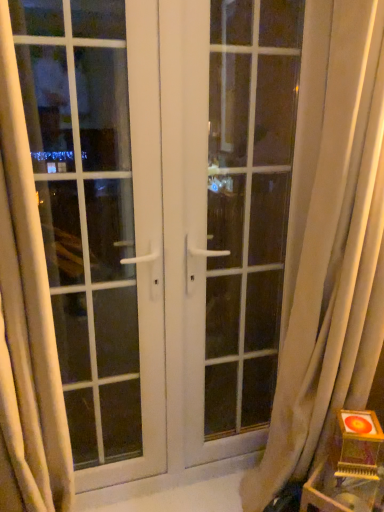
Locate an element on the screen. Image resolution: width=384 pixels, height=512 pixels. white glossy door at center is located at coordinates (239, 217).

Measure the distance between point (48,508) and camera.

They are 1.10 meters apart.

The height and width of the screenshot is (512, 384). In order to click on white sheer curtain at right, acting as the 2th curtain starting from the left in this screenshot , I will do `click(329, 243)`.

At what (x,y) coordinates should I click in order to perform the action: click on wooden table at lower right. Please return your answer as a coordinate pair (x, y). Looking at the image, I should click on (343, 490).

Which curtain is the 2nd one when counting from the left side of the wooden table at lower right? Please provide its 2D coordinates.

[(26, 324)]

Is white sheer curtain at left, the 1th curtain viewed from the left, far from wooden table at lower right?

No, white sheer curtain at left, the 1th curtain viewed from the left, is not far away from wooden table at lower right.

Considering the sizes of objects white sheer curtain at left, the 1th curtain viewed from the left, and wooden table at lower right in the image provided, who is smaller, white sheer curtain at left, the 1th curtain viewed from the left, or wooden table at lower right?

Smaller between the two is wooden table at lower right.

Is white sheer curtain at left, the 1th curtain viewed from the left, looking in the opposite direction of wooden table at lower right?

No, white sheer curtain at left, the 1th curtain viewed from the left, is not facing the opposite direction of wooden table at lower right.

Does point (31, 396) come closer to viewer compared to point (232, 40)?

Yes, it is.

Looking at this image, considering the relative sizes of white sheer curtain at left, placed as the second curtain when sorted from right to left, and white glossy door at center in the image provided, is white sheer curtain at left, placed as the second curtain when sorted from right to left, smaller than white glossy door at center?

Yes, white sheer curtain at left, placed as the second curtain when sorted from right to left, is smaller than white glossy door at center.

How many degrees apart are the facing directions of white sheer curtain at left, the 1th curtain viewed from the left, and white glossy door at center?

There is a 0.993-degree angle between the facing directions of white sheer curtain at left, the 1th curtain viewed from the left, and white glossy door at center.

Considering the positions of objects white sheer curtain at left, the 1th curtain viewed from the left, and white glossy door at center in the image provided, who is in front, white sheer curtain at left, the 1th curtain viewed from the left, or white glossy door at center?

white sheer curtain at left, the 1th curtain viewed from the left.

Which of these two, white glossy door at center or white sheer curtain at left, the 1th curtain viewed from the left, is bigger?

With larger size is white glossy door at center.

From their relative heights in the image, would you say white glossy door at center is taller or shorter than white sheer curtain at left, placed as the second curtain when sorted from right to left?

Clearly, white glossy door at center is taller compared to white sheer curtain at left, placed as the second curtain when sorted from right to left.

Does white glossy door at center touch white sheer curtain at left, the 1th curtain viewed from the left?

No, white glossy door at center is not in contact with white sheer curtain at left, the 1th curtain viewed from the left.

Considering the sizes of objects white glossy door at center and white sheer curtain at left, the 1th curtain viewed from the left, in the image provided, who is thinner, white glossy door at center or white sheer curtain at left, the 1th curtain viewed from the left,?

Thinner between the two is white glossy door at center.

In the scene shown: From a real-world perspective, is white glossy door at center above or below white glass window at center?

white glossy door at center is situated higher than white glass window at center in the real world.

From the image's perspective, is white glossy door at center above white glass window at center?

Correct, white glossy door at center appears higher than white glass window at center in the image.

Based on the photo, how different are the orientations of white glossy door at center and white glass window at center in degrees?

The angular difference between white glossy door at center and white glass window at center is 0.015 degrees.

Does white glossy door at center touch white glass window at center?

No, white glossy door at center is not in contact with white glass window at center.

Which object is further away from the camera, white glass window at center or white sheer curtain at right, the first curtain in the right-to-left sequence?

white glass window at center is further away from the camera.

From a real-world perspective, is white glass window at center located beneath white sheer curtain at right, acting as the 2th curtain starting from the left?

No.

How many degrees apart are the facing directions of white glass window at center and white sheer curtain at right, acting as the 2th curtain starting from the left?

The angle between the facing direction of white glass window at center and the facing direction of white sheer curtain at right, acting as the 2th curtain starting from the left, is 0.99 degrees.

From the image's perspective, relative to white sheer curtain at right, acting as the 2th curtain starting from the left, is white glass window at center above or below?

white glass window at center is above white sheer curtain at right, acting as the 2th curtain starting from the left.

Is wooden table at lower right inside or outside of white glossy door at center?

wooden table at lower right lies outside white glossy door at center.

Considering the sizes of wooden table at lower right and white glossy door at center in the image, is wooden table at lower right wider or thinner than white glossy door at center?

Clearly, wooden table at lower right has more width compared to white glossy door at center.

Does wooden table at lower right lie behind white glossy door at center?

No, it is in front of white glossy door at center.

Does point (369, 489) lie behind point (186, 384)?

No.

Does white sheer curtain at left, placed as the second curtain when sorted from right to left, turn towards white sheer curtain at right, the first curtain in the right-to-left sequence?

No, white sheer curtain at left, placed as the second curtain when sorted from right to left, is not oriented towards white sheer curtain at right, the first curtain in the right-to-left sequence.

Who is taller, white sheer curtain at left, the 1th curtain viewed from the left, or white sheer curtain at right, the first curtain in the right-to-left sequence?

white sheer curtain at right, the first curtain in the right-to-left sequence.

Which object is further away from the camera taking this photo, white sheer curtain at left, the 1th curtain viewed from the left, or white sheer curtain at right, the first curtain in the right-to-left sequence?

white sheer curtain at right, the first curtain in the right-to-left sequence, is more distant.

From the image's perspective, is white sheer curtain at left, placed as the second curtain when sorted from right to left, above or below white sheer curtain at right, acting as the 2th curtain starting from the left?

Clearly, from the image's perspective, white sheer curtain at left, placed as the second curtain when sorted from right to left, is below white sheer curtain at right, acting as the 2th curtain starting from the left.

At what (x,y) coordinates should I click in order to perform the action: click on curtain that is the 2nd one when counting forward from the wooden table at lower right. Please return your answer as a coordinate pair (x, y). This screenshot has width=384, height=512. Looking at the image, I should click on (26, 324).

Identify the location of the 2nd curtain below the white glossy door at center (from the image's perspective). [x=26, y=324].

Looking at the image, which one is located closer to white sheer curtain at left, the 1th curtain viewed from the left, white sheer curtain at right, acting as the 2th curtain starting from the left, or white glossy door at center?

white sheer curtain at right, acting as the 2th curtain starting from the left, is positioned closer to the anchor white sheer curtain at left, the 1th curtain viewed from the left.

Estimate the real-world distances between objects in this image. Which object is closer to white sheer curtain at right, acting as the 2th curtain starting from the left, white glass window at center or white glossy door at center?

Among the two, white glossy door at center is located nearer to white sheer curtain at right, acting as the 2th curtain starting from the left.

Looking at the image, which one is located closer to white glossy door at center, wooden table at lower right or white sheer curtain at right, acting as the 2th curtain starting from the left?

white sheer curtain at right, acting as the 2th curtain starting from the left.

Estimate the real-world distances between objects in this image. Which object is closer to white sheer curtain at right, the first curtain in the right-to-left sequence, white glossy door at center or white glass window at center?

white glossy door at center is positioned closer to the anchor white sheer curtain at right, the first curtain in the right-to-left sequence.

Which object lies nearer to the anchor point white glossy door at center, white sheer curtain at left, the 1th curtain viewed from the left, or wooden table at lower right?

wooden table at lower right.

Looking at the image, which one is located further to white glass window at center, white sheer curtain at left, placed as the second curtain when sorted from right to left, or white sheer curtain at right, the first curtain in the right-to-left sequence?

white sheer curtain at right, the first curtain in the right-to-left sequence, lies further to white glass window at center than the other object.

Looking at the image, which one is located further to white glossy door at center, wooden table at lower right or white sheer curtain at left, placed as the second curtain when sorted from right to left?

The object further to white glossy door at center is white sheer curtain at left, placed as the second curtain when sorted from right to left.

Estimate the real-world distances between objects in this image. Which object is further from white sheer curtain at left, the 1th curtain viewed from the left, wooden table at lower right or white sheer curtain at right, acting as the 2th curtain starting from the left?

wooden table at lower right.

Where is `curtain between white glass window at center and wooden table at lower right`? The width and height of the screenshot is (384, 512). curtain between white glass window at center and wooden table at lower right is located at coordinates (329, 243).

Where is `window between white sheer curtain at left, placed as the second curtain when sorted from right to left, and white glossy door at center, in the horizontal direction`? The height and width of the screenshot is (512, 384). window between white sheer curtain at left, placed as the second curtain when sorted from right to left, and white glossy door at center, in the horizontal direction is located at coordinates (x=100, y=220).

This screenshot has width=384, height=512. I want to click on window between white glossy door at center and wooden table at lower right in the up-down direction, so click(100, 220).

Identify the location of screen door between white sheer curtain at left, placed as the second curtain when sorted from right to left, and wooden table at lower right, in the horizontal direction. (239, 217).